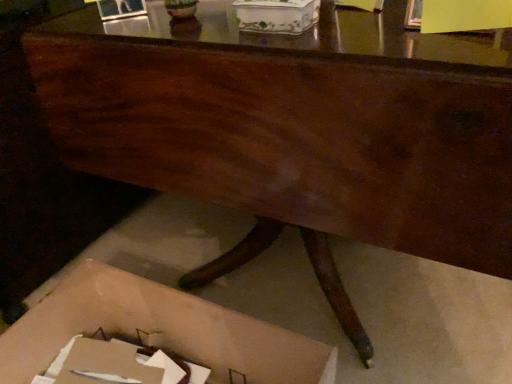
At what (x,y) coordinates should I click in order to perform the action: click on free space that is to the left of porcelain floral box at center, marked as the first storage box in a top-to-bottom arrangement. Please return your answer as a coordinate pair (x, y). This screenshot has width=512, height=384. Looking at the image, I should click on (198, 23).